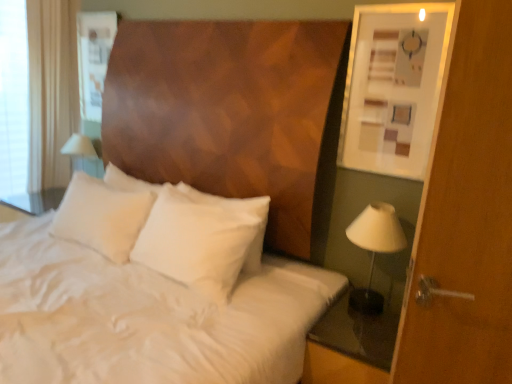
Question: Relative to matte white picture frame at upper right, is white satin bedsheet at center in front or behind?

Choices:
 (A) front
 (B) behind

Answer: (A)

Question: From the image's perspective, relative to matte white picture frame at upper right, is white satin bedsheet at center above or below?

Choices:
 (A) below
 (B) above

Answer: (A)

Question: Estimate the real-world distances between objects in this image. Which object is closer to the white fabric at left?

Choices:
 (A) transparent glass nightstand at lower right
 (B) matte white picture frame at upper right
 (C) white soft pillow at center
 (D) white satin bedsheet at center
 (E) white fabric lampshade at right

Answer: (C)

Question: Which object is positioned farthest from the white fabric at left?

Choices:
 (A) white soft pillow at center
 (B) matte white picture frame at upper right
 (C) transparent glass nightstand at lower right
 (D) white satin bedsheet at center
 (E) white fabric lampshade at right

Answer: (E)